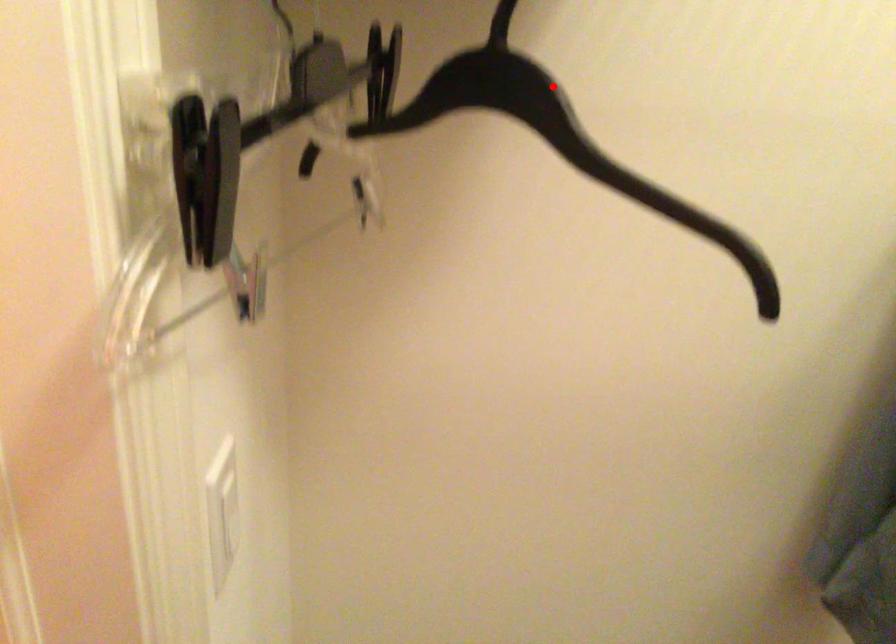
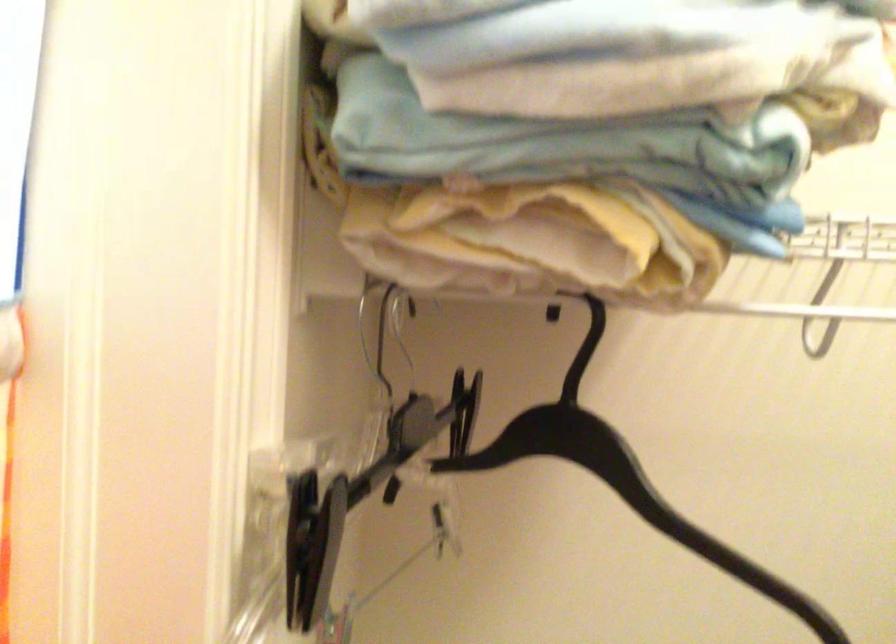
Question: I am providing you with two images of the same scene from different viewpoints. Image1 has a red point marked. In image2, the corresponding 3D location appears at what relative position? Reply with the corresponding letter.

Choices:
 (A) Closer
 (B) Farther

Answer: (B)